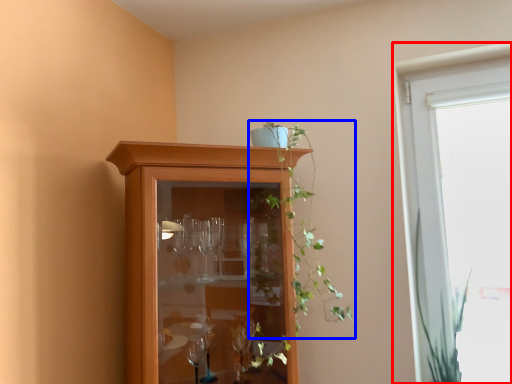
Question: Which of the following is the closest to the observer, window (highlighted by a red box) or houseplant (highlighted by a blue box)?

Choices:
 (A) window
 (B) houseplant

Answer: (B)